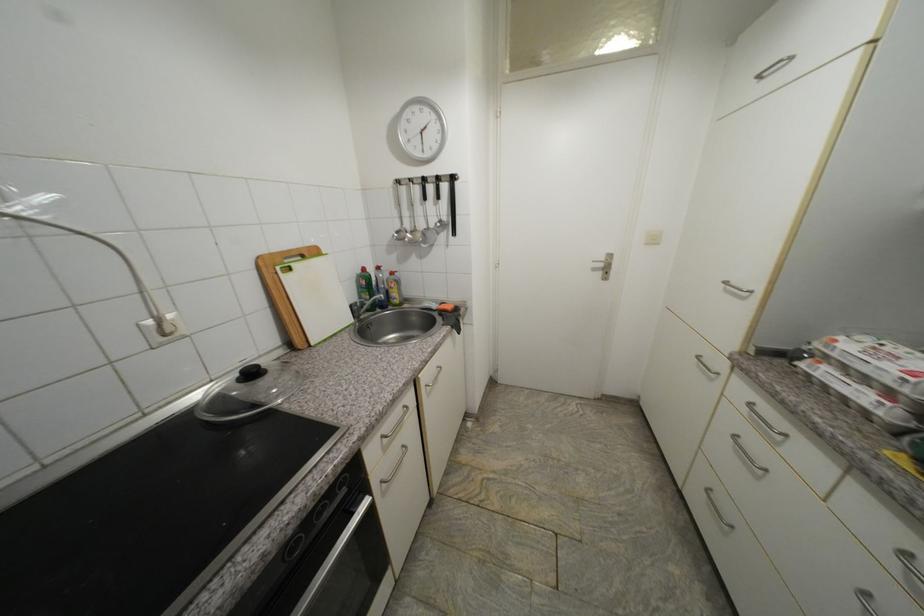
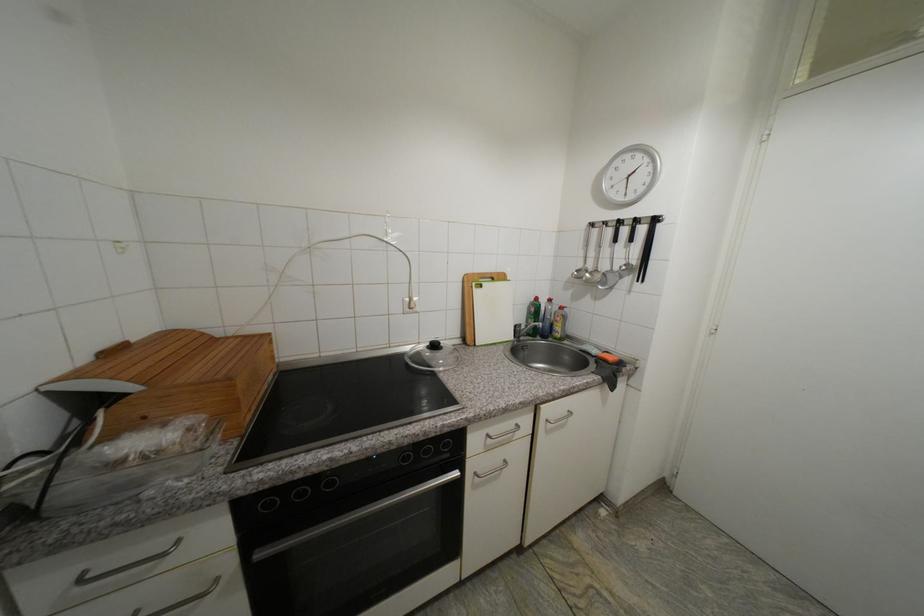
Question: The camera is either moving clockwise (left) or counter-clockwise (right) around the object. The first image is from the beginning of the video and the second image is from the end. Is the camera moving left or right when shooting the video?

Choices:
 (A) Left
 (B) Right

Answer: (B)